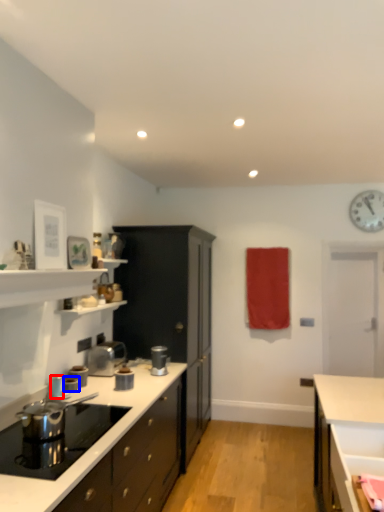
Question: Which object is further to the camera taking this photo, kitchen appliance (highlighted by a red box) or kitchen appliance (highlighted by a blue box)?

Choices:
 (A) kitchen appliance
 (B) kitchen appliance

Answer: (B)